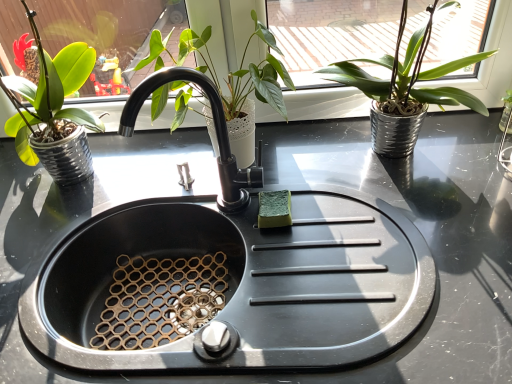
Question: Is black matte faucet at center wider or thinner than green matte plant pot at left, positioned as the first houseplant in left-to-right order?

Choices:
 (A) wide
 (B) thin

Answer: (B)

Question: Considering the positions of black matte faucet at center and green matte plant pot at left, placed as the 3th houseplant when sorted from right to left, in the image, is black matte faucet at center bigger or smaller than green matte plant pot at left, placed as the 3th houseplant when sorted from right to left,?

Choices:
 (A) small
 (B) big

Answer: (A)

Question: Estimate the real-world distances between objects in this image. Which object is closer to the black matte faucet at center?

Choices:
 (A) green matte plant at upper right, marked as the first houseplant in a right-to-left arrangement
 (B) green matte plant pot at left, placed as the 3th houseplant when sorted from right to left
 (C) black matte sink at center
 (D) green matte plant at center, arranged as the second houseplant when viewed from the right

Answer: (D)

Question: Estimate the real-world distances between objects in this image. Which object is closer to the black matte sink at center?

Choices:
 (A) green matte plant at center, arranged as the second houseplant when viewed from the right
 (B) green matte plant pot at left, placed as the 3th houseplant when sorted from right to left
 (C) black matte faucet at center
 (D) green matte plant at upper right, marked as the first houseplant in a right-to-left arrangement

Answer: (C)